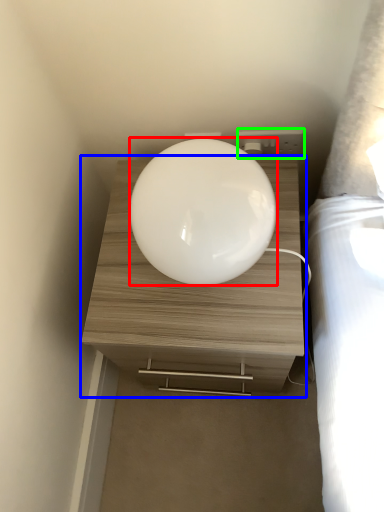
Question: Which is farther away from oval (highlighted by a red box)? nightstand (highlighted by a blue box) or electric outlet (highlighted by a green box)?

Choices:
 (A) nightstand
 (B) electric outlet

Answer: (B)